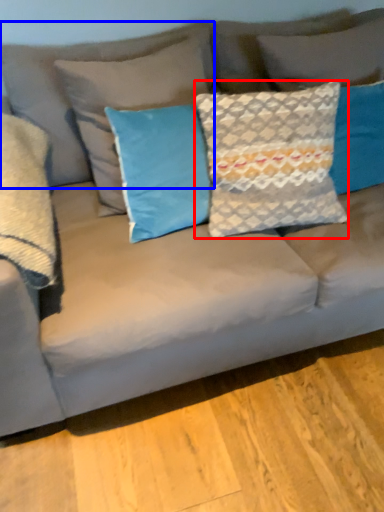
Question: Which of the following is the closest to the observer, pillow (highlighted by a red box) or pillow (highlighted by a blue box)?

Choices:
 (A) pillow
 (B) pillow

Answer: (A)